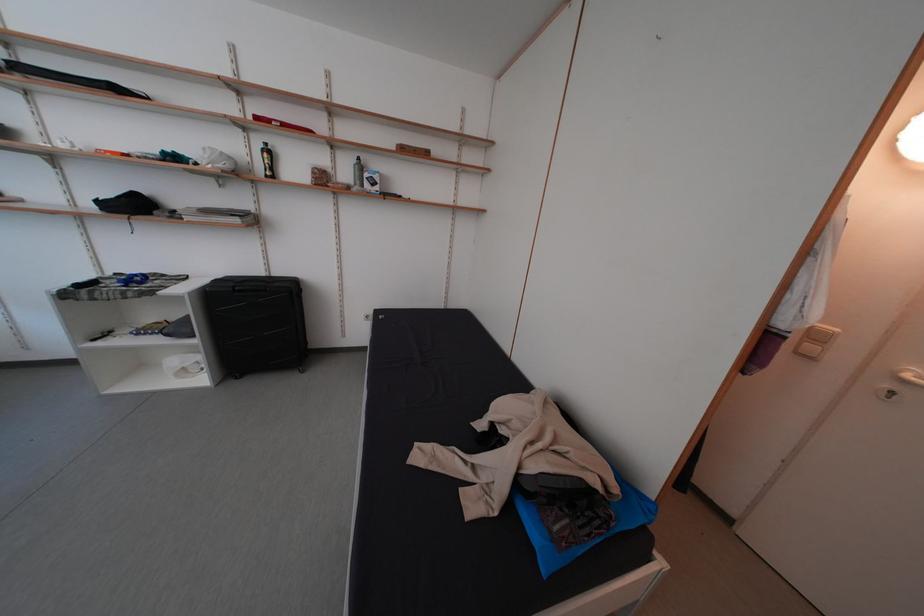
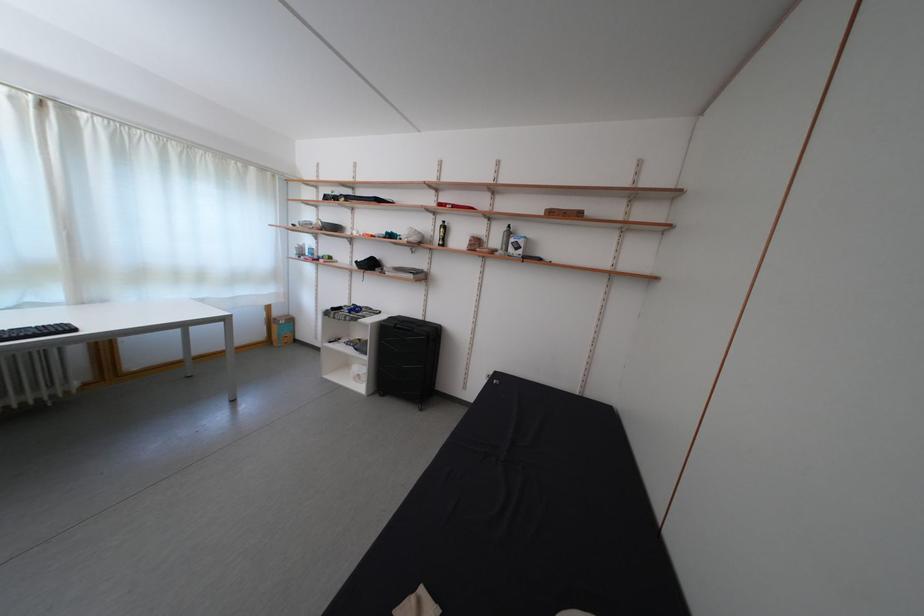
Where in the second image is the point corresponding to [189,374] from the first image?

(365, 381)